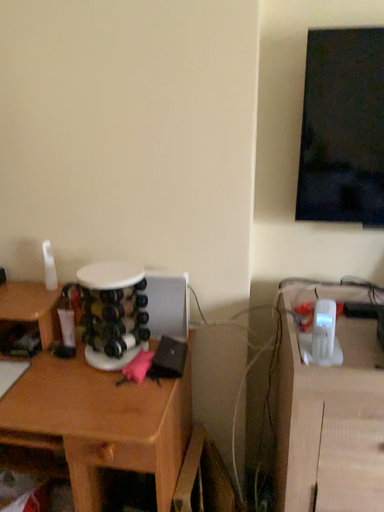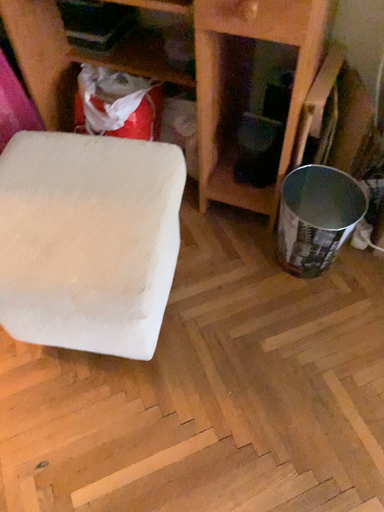
Question: How did the camera likely rotate when shooting the video?

Choices:
 (A) rotated downward
 (B) rotated upward

Answer: (A)